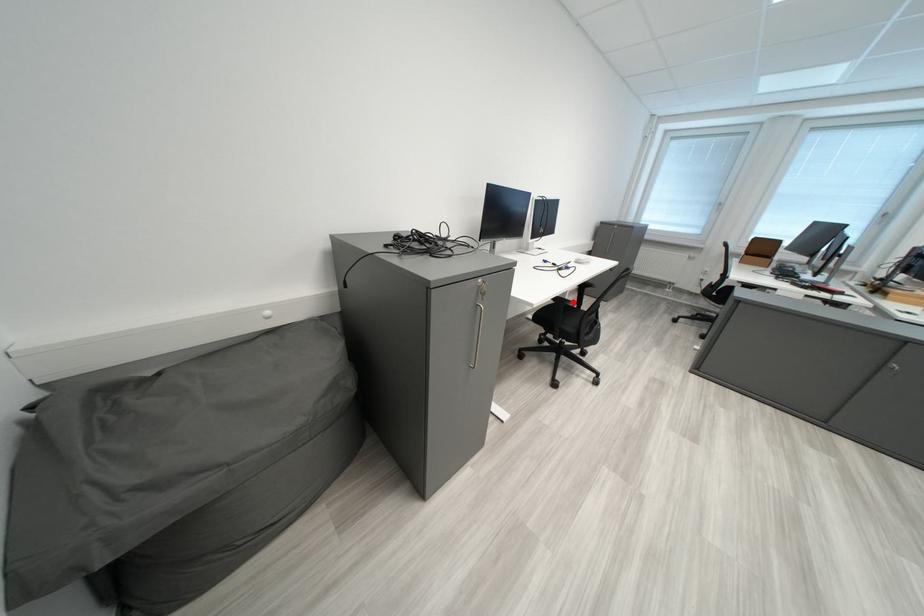
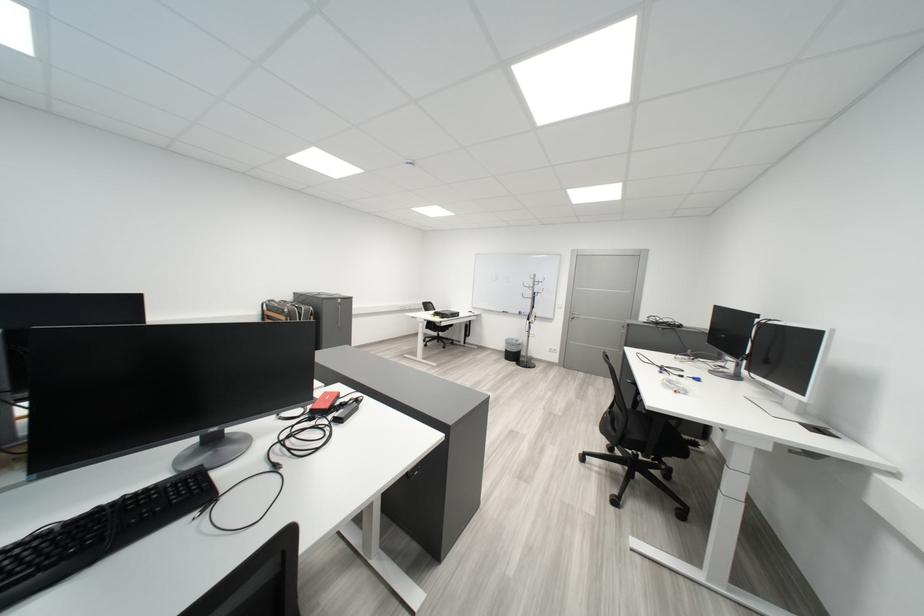
Question: I am providing you with two images of the same scene from different viewpoints. A red point is marked on the first image. Is the red point's position out of view in image 2?

Choices:
 (A) Yes
 (B) No

Answer: (A)